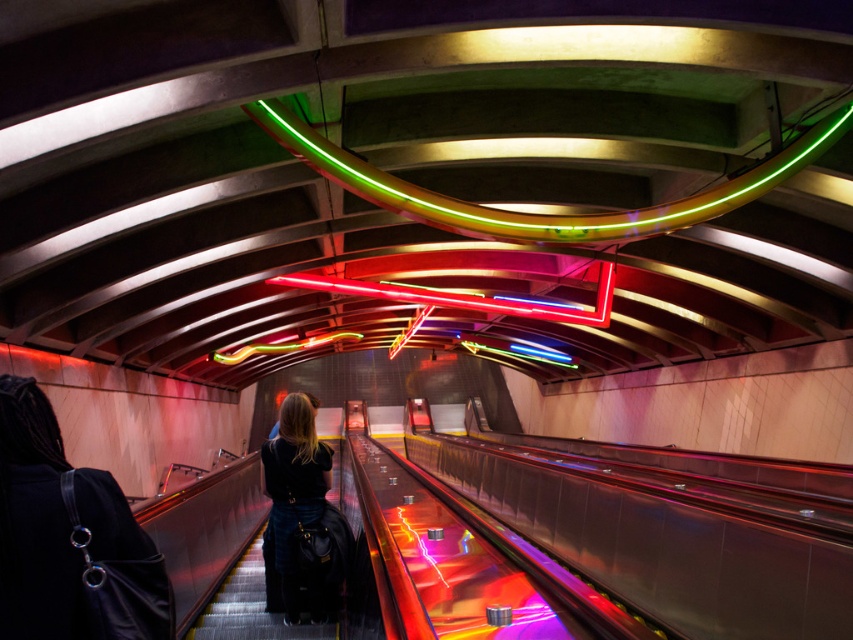
You are standing in the subway station and see the black leather jacket at lower left and the dark blue denim jeans at center. Which object is positioned more to the right side of the scene?

The black leather jacket at lower left is positioned to the right of the dark blue denim jeans at center, so the black leather jacket at lower left is more to the right side of the scene.